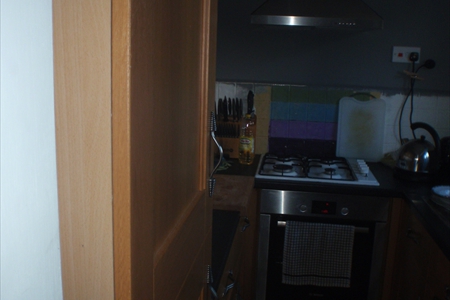
You are a GUI agent. You are given a task and a screenshot of the screen. Output one action in this format:
    pyautogui.click(x=<x>, y=<y>)
    Task: Click on the kitchen counter top
    This screenshot has width=450, height=300.
    Given the screenshot: What is the action you would take?
    pyautogui.click(x=232, y=186)